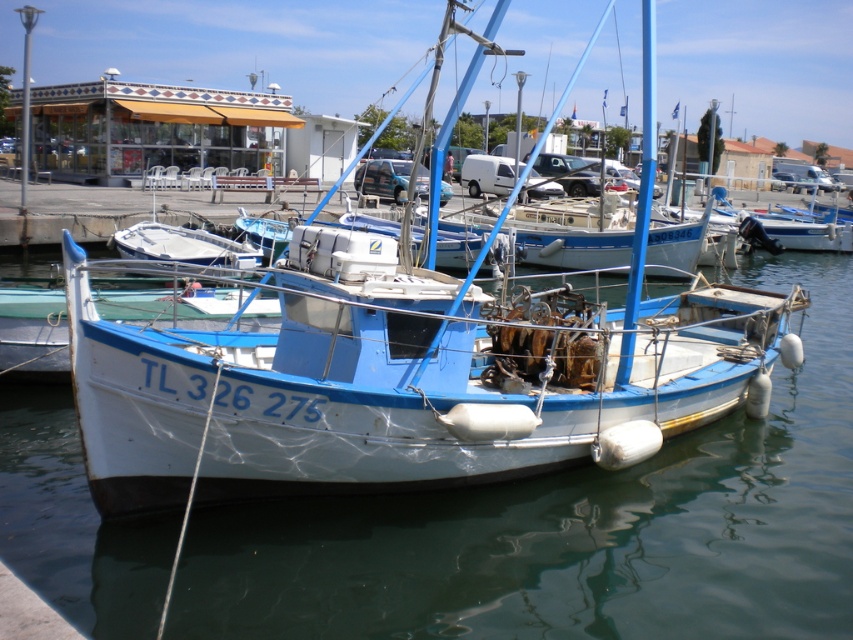
Question: Does white glossy water at center appear on the left side of white matte boat at center?

Choices:
 (A) yes
 (B) no

Answer: (A)

Question: Which point appears farthest from the camera in this image?

Choices:
 (A) (207, 579)
 (B) (90, 348)

Answer: (A)

Question: Is white glossy water at center closer to the viewer compared to white matte boat at center?

Choices:
 (A) yes
 (B) no

Answer: (A)

Question: Does white glossy water at center have a smaller size compared to white matte boat at center?

Choices:
 (A) yes
 (B) no

Answer: (A)